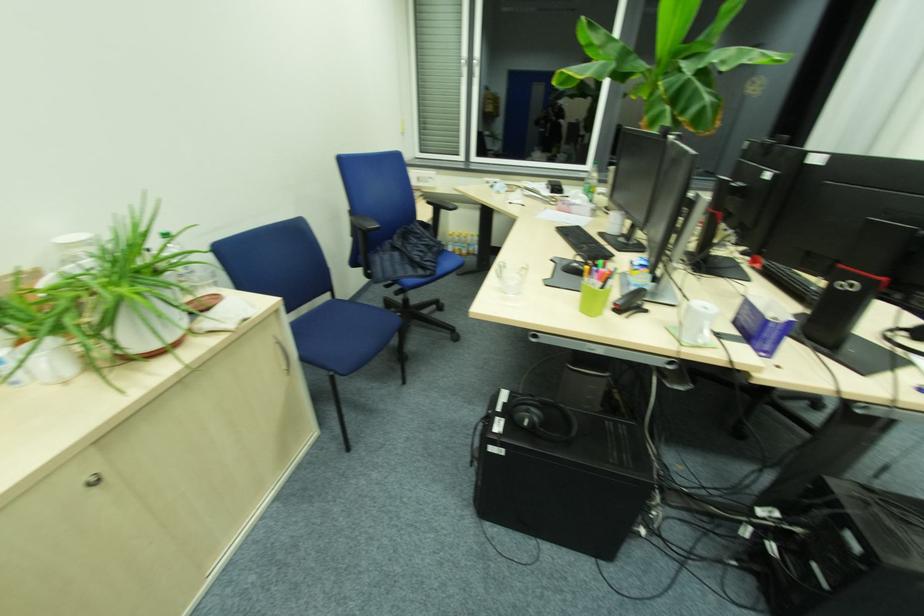
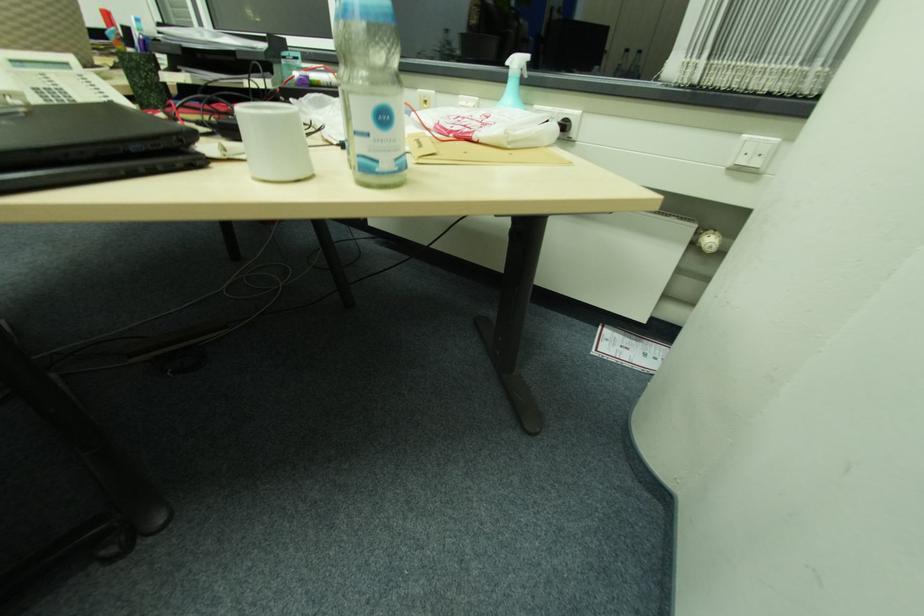
Consider the image. The images are taken continuously from a first-person perspective. In which direction are you moving?

The cameraman walked toward right, forward.